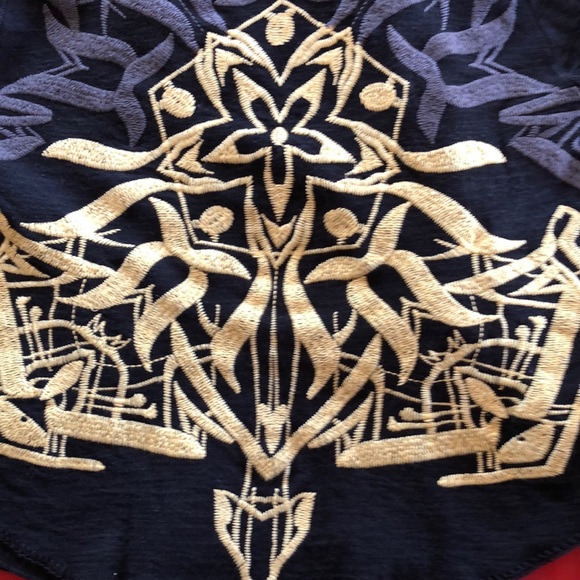
Locate an element on the screen. Image resolution: width=580 pixels, height=580 pixels. fabric is located at coordinates (529, 198).